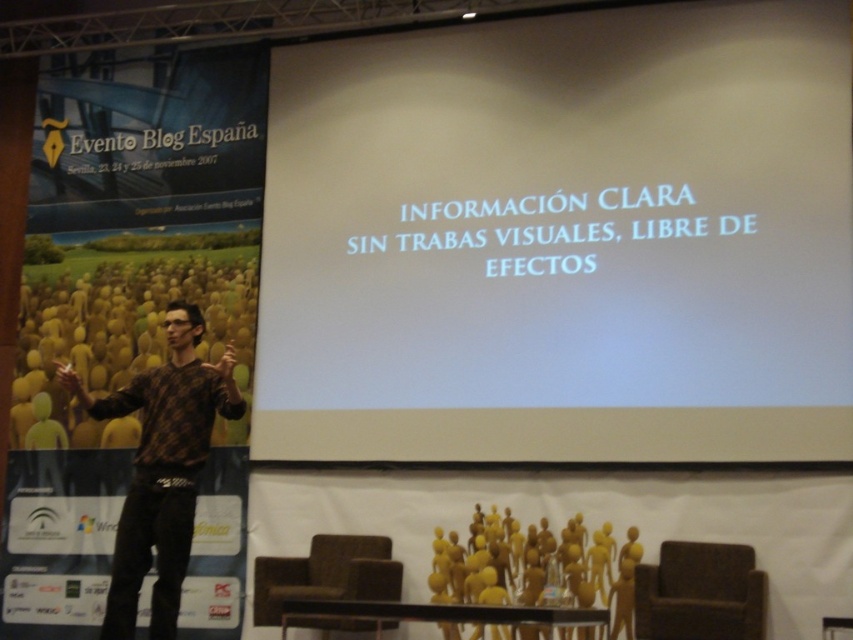
Question: Can you confirm if white matte projection screen at center is positioned to the right of brown fabric chair at lower right?

Choices:
 (A) yes
 (B) no

Answer: (A)

Question: Which object is the farthest from the brown fabric chair at lower right?

Choices:
 (A) white matte projection screen at center
 (B) brown fabric chair at lower center

Answer: (A)

Question: Considering the relative positions of white matte projection screen at center and brown textured sweater at center in the image provided, where is white matte projection screen at center located with respect to brown textured sweater at center?

Choices:
 (A) right
 (B) left

Answer: (A)

Question: Which object is farther from the camera taking this photo?

Choices:
 (A) brown fabric chair at lower center
 (B) white matte projection screen at center

Answer: (B)

Question: Does brown textured sweater at center have a larger size compared to brown fabric chair at lower right?

Choices:
 (A) no
 (B) yes

Answer: (B)

Question: Which point appears farthest from the camera in this image?

Choices:
 (A) [x=323, y=548]
 (B) [x=171, y=404]

Answer: (A)